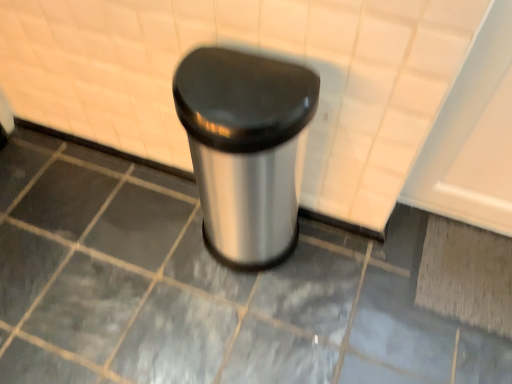
I want to click on vacant space to the right of polished stainless steel trash can at center, so click(329, 266).